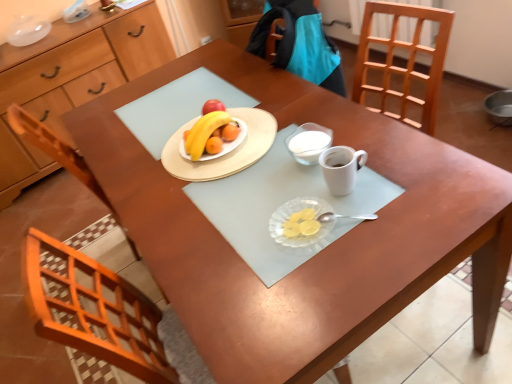
Image resolution: width=512 pixels, height=384 pixels. Find the location of `vacant space to the right of yellow matte grapefruit at center`. vacant space to the right of yellow matte grapefruit at center is located at coordinates (272, 122).